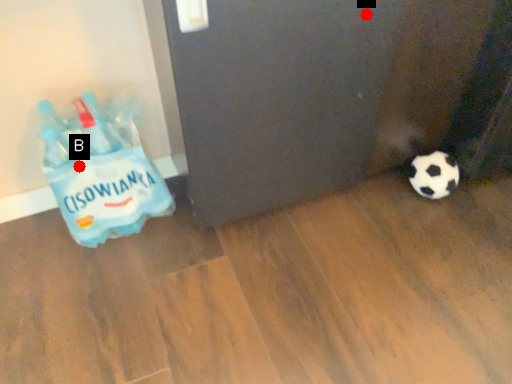
Question: Two points are circled on the image, labeled by A and B beside each circle. Which point is farther to the camera?

Choices:
 (A) A is further
 (B) B is further

Answer: (B)